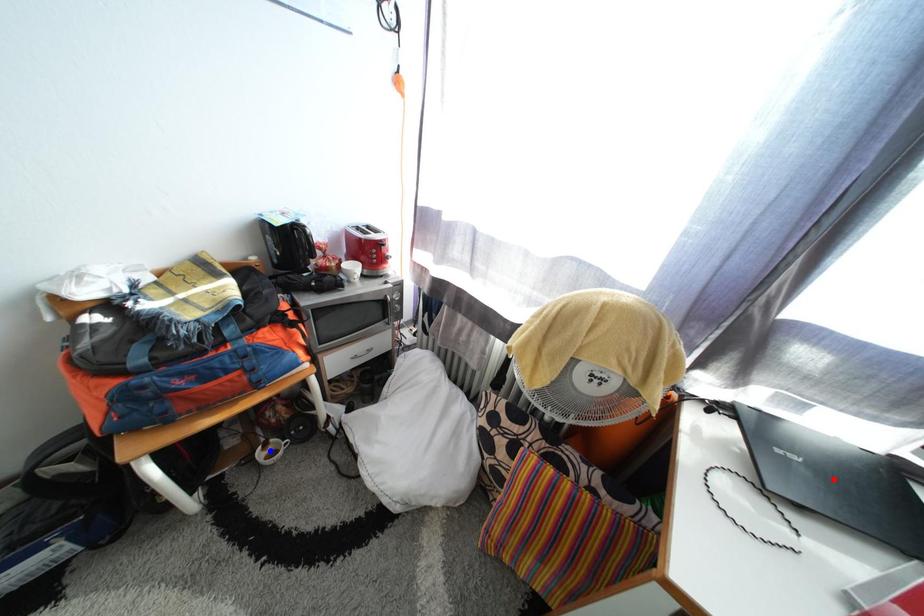
Question: Two points are marked on the image. Which point is closer to the camera?

Choices:
 (A) Blue point is closer.
 (B) Red point is closer.

Answer: (B)